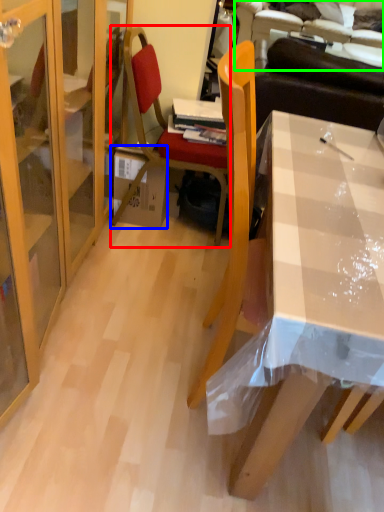
Question: Based on their relative distances, which object is nearer to chair (highlighted by a red box)? Choose from box (highlighted by a blue box) and couch (highlighted by a green box).

Choices:
 (A) box
 (B) couch

Answer: (A)